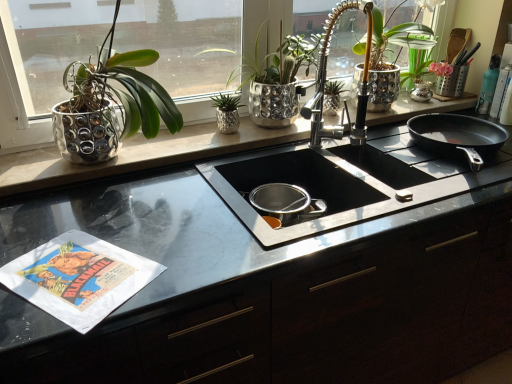
Question: Considering the positions of shiny metallic pot at center, marked as the 2th houseplant in a right-to-left arrangement, and green metallic plant at center, which is the 2th houseplant in left-to-right order, in the image, is shiny metallic pot at center, marked as the 2th houseplant in a right-to-left arrangement, wider or thinner than green metallic plant at center, which is the 2th houseplant in left-to-right order,?

Choices:
 (A) wide
 (B) thin

Answer: (A)

Question: Is point (259, 34) positioned closer to the camera than point (221, 129)?

Choices:
 (A) farther
 (B) closer

Answer: (A)

Question: Based on their relative distances, which object is nearer to the black stainless steel gas stove at center?

Choices:
 (A) shiny metallic pot at center, marked as the 2th houseplant in a right-to-left arrangement
 (B) black glossy countertop at center
 (C) black non-stick frying pan at right
 (D) wooden utensils at upper right
 (E) green metallic plant at center, which is the 2th houseplant in left-to-right order

Answer: (C)

Question: Estimate the real-world distances between objects in this image. Which object is closer to the shiny silver pot at upper right, the first houseplant positioned from the right?

Choices:
 (A) black non-stick frying pan at right
 (B) black glossy countertop at center
 (C) wooden utensils at upper right
 (D) black stainless steel gas stove at center
 (E) shiny metallic pot at center, marked as the 2th houseplant in a right-to-left arrangement

Answer: (C)